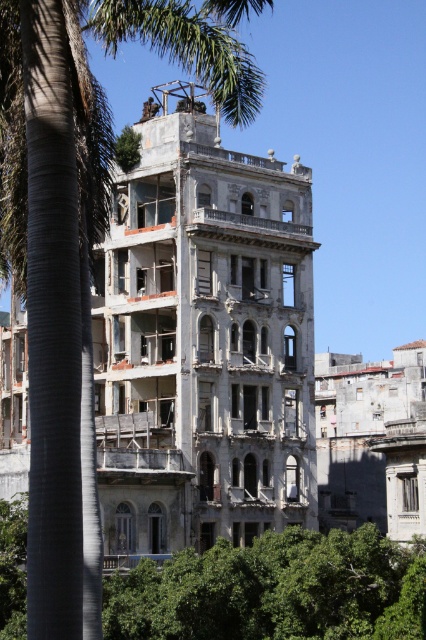
You are standing at the center of the image and want to locate the green leafy palm tree at left. In which direction should you look to find it?

The green leafy palm tree at left is located at the left side of the image, so you should look to your left to find it.

You are standing in front of the building and notice two trees nearby. The green leafy palm tree at left and the green leafy tree at center. Which tree is closer to the building?

The green leafy palm tree at left is positioned over the green leafy tree at center, meaning it is closer to the building.

You are standing in front of the damaged building and notice two points marked on its facade. The first point is located at coordinates point [80,554] and the second at point [423,573]. Which of these points is closer to you as you face the building?

Point [80,554] is closer to you because it is in front of point [423,573].